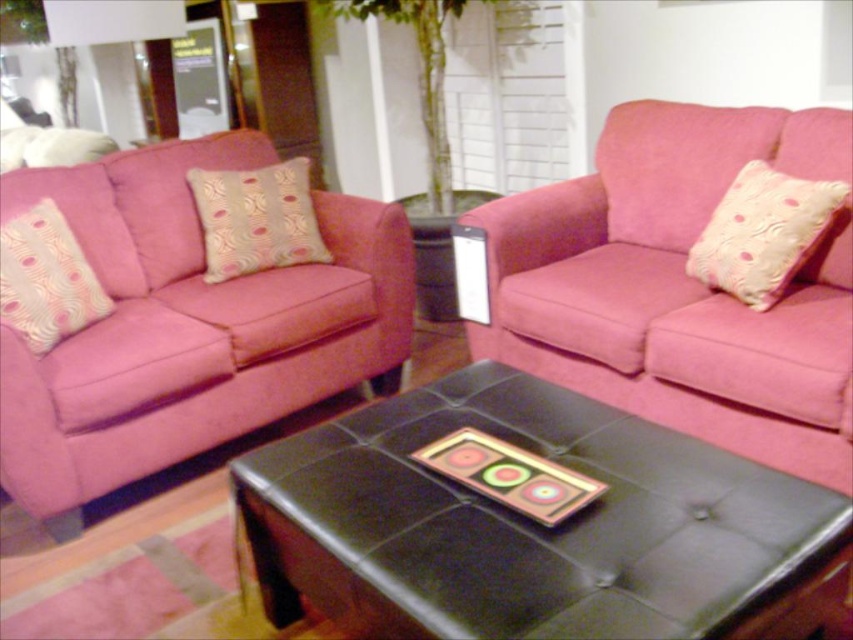
Can you confirm if black leather ottoman at center is positioned to the right of patterned fabric pillow at center?

Indeed, black leather ottoman at center is positioned on the right side of patterned fabric pillow at center.

Who is more forward, (825, 518) or (222, 195)?

Point (825, 518) is more forward.

The width and height of the screenshot is (853, 640). What are the coordinates of `black leather ottoman at center` in the screenshot? It's located at (532, 525).

From the picture: Who is more forward, (x=723, y=116) or (x=25, y=220)?

Point (x=25, y=220)

The width and height of the screenshot is (853, 640). Describe the element at coordinates (679, 285) in the screenshot. I see `matte pink couch at center` at that location.

Which is in front, point (817, 140) or point (16, 260)?

Point (16, 260) is more forward.

Locate an element on the screen. Image resolution: width=853 pixels, height=640 pixels. matte pink couch at center is located at coordinates (679, 285).

Is black leather ottoman at center taller than pink fabric pillow at left?

Yes, black leather ottoman at center is taller than pink fabric pillow at left.

Is point (515, 586) less distant than point (12, 282)?

That is True.

Which is in front, point (524, 577) or point (78, 314)?

Positioned in front is point (524, 577).

What are the coordinates of `black leather ottoman at center` in the screenshot? It's located at (532, 525).